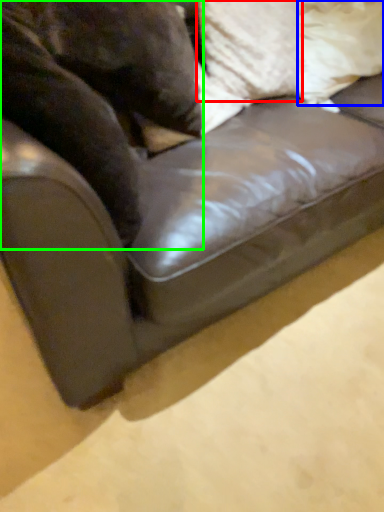
Question: Estimate the real-world distances between objects in this image. Which object is farther from pillow (highlighted by a red box), pillow (highlighted by a blue box) or animal (highlighted by a green box)?

Choices:
 (A) pillow
 (B) animal

Answer: (B)